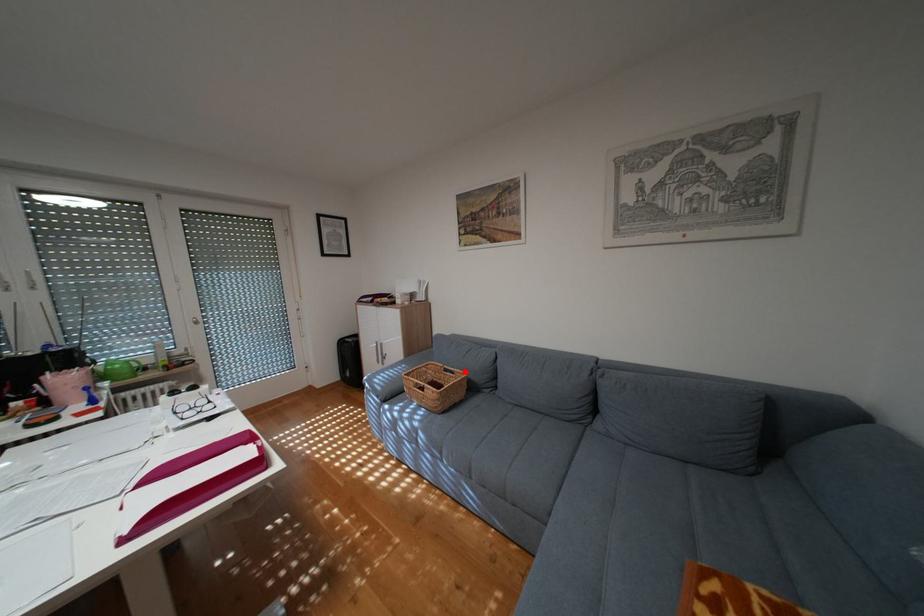
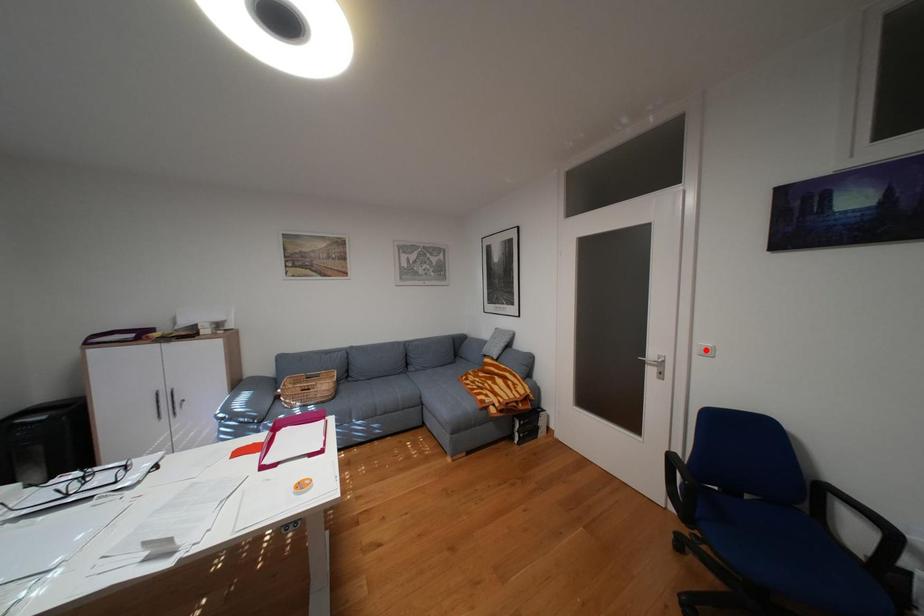
I am providing you with two images of the same scene from different viewpoints. A red point is marked on the first image and another point is marked on the second image. Is the red point in image1 aligned with the point shown in image2?

No